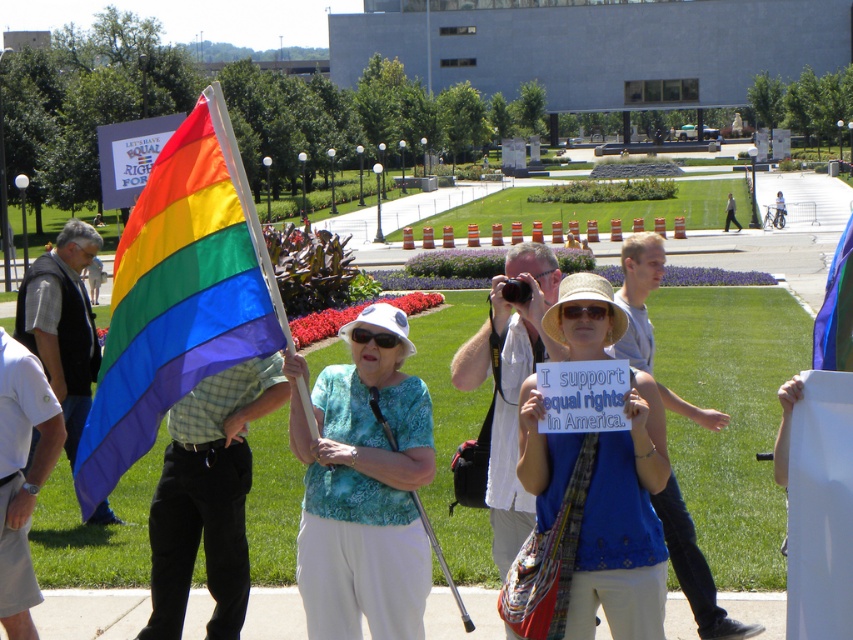
Which of these two, white fabric hat at center or rainbow fabric flag at center, stands taller?

With more height is rainbow fabric flag at center.

Is white fabric hat at center bigger than rainbow fabric flag at center?

Incorrect, white fabric hat at center is not larger than rainbow fabric flag at center.

Locate an element on the screen. Image resolution: width=853 pixels, height=640 pixels. white fabric hat at center is located at coordinates (x=364, y=488).

Can you confirm if rainbow fabric flag at left is thinner than white fabric hat at center?

No.

Does rainbow fabric flag at left have a smaller size compared to white fabric hat at center?

No, rainbow fabric flag at left is not smaller than white fabric hat at center.

Where is `rainbow fabric flag at left`? rainbow fabric flag at left is located at coordinates [177, 296].

Describe the element at coordinates (364, 488) in the screenshot. This screenshot has height=640, width=853. I see `white fabric hat at center` at that location.

Does white fabric hat at center have a greater height compared to blue fabric sign at center?

Indeed, white fabric hat at center has a greater height compared to blue fabric sign at center.

You are a GUI agent. You are given a task and a screenshot of the screen. Output one action in this format:
    pyautogui.click(x=<x>, y=<y>)
    Task: Click on the white fabric hat at center
    This screenshot has width=853, height=640.
    Given the screenshot: What is the action you would take?
    pyautogui.click(x=364, y=488)